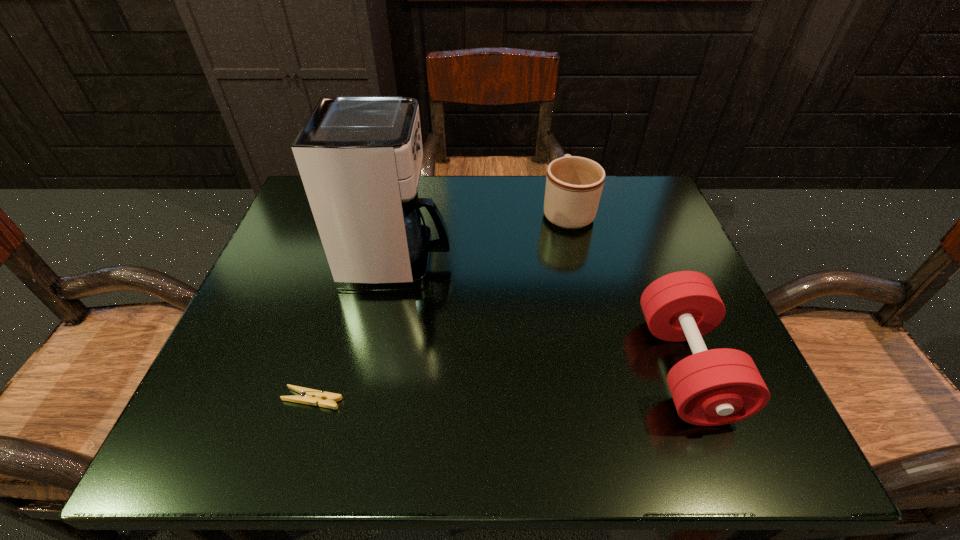
Find the location of a particular element. The image size is (960, 540). the second farthest object is located at coordinates (359, 157).

Where is `coffee maker`? Image resolution: width=960 pixels, height=540 pixels. coffee maker is located at coordinates (359, 157).

Identify the location of the second object from right to left. (574, 184).

At what (x,y) coordinates should I click in order to perform the action: click on mug. Please return your answer as a coordinate pair (x, y). Looking at the image, I should click on (574, 184).

Where is `dumbbell`? dumbbell is located at coordinates (714, 387).

Where is `the shortest object`? Image resolution: width=960 pixels, height=540 pixels. the shortest object is located at coordinates (308, 396).

At what (x,y) coordinates should I click in order to perform the action: click on vacant space situated on the front panel of the tallest object. Please return your answer as a coordinate pair (x, y). The image size is (960, 540). Looking at the image, I should click on (624, 261).

Locate an element on the screen. free point located on the side of the mug with the handle is located at coordinates (560, 179).

Locate an element on the screen. Image resolution: width=960 pixels, height=540 pixels. free point located on the side of the mug with the handle is located at coordinates (561, 181).

The image size is (960, 540). Identify the location of vacant area situated 0.170m on the back of the dumbbell. (641, 254).